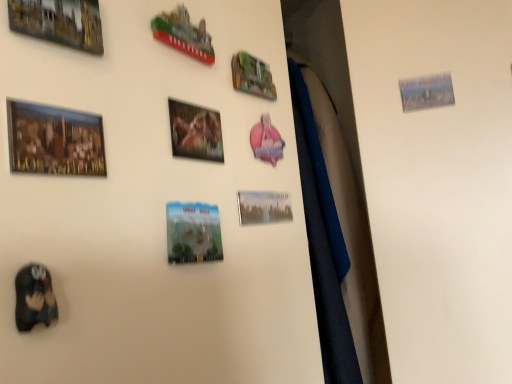
Question: Can you confirm if gold metallic picture frame at upper left, arranged as the first picture frame when viewed from the left, is bigger than matte wooden picture frame at upper left, positioned as the 2th picture frame in left-to-right order?

Choices:
 (A) yes
 (B) no

Answer: (A)

Question: Is gold metallic picture frame at upper left, arranged as the first picture frame when viewed from the left, not inside matte wooden picture frame at upper left, which appears as the seventh picture frame when viewed from the right?

Choices:
 (A) no
 (B) yes

Answer: (B)

Question: Considering the relative positions of gold metallic picture frame at upper left, arranged as the first picture frame when viewed from the left, and matte wooden picture frame at upper left, which appears as the seventh picture frame when viewed from the right, in the image provided, is gold metallic picture frame at upper left, arranged as the first picture frame when viewed from the left, in front of matte wooden picture frame at upper left, which appears as the seventh picture frame when viewed from the right,?

Choices:
 (A) yes
 (B) no

Answer: (B)

Question: Could matte wooden picture frame at upper left, positioned as the 2th picture frame in left-to-right order, be considered to be inside gold metallic picture frame at upper left, arranged as the first picture frame when viewed from the left?

Choices:
 (A) no
 (B) yes

Answer: (A)

Question: Considering the relative sizes of gold metallic picture frame at upper left, arranged as the first picture frame when viewed from the left, and matte wooden picture frame at upper left, positioned as the 2th picture frame in left-to-right order, in the image provided, is gold metallic picture frame at upper left, arranged as the first picture frame when viewed from the left, shorter than matte wooden picture frame at upper left, positioned as the 2th picture frame in left-to-right order,?

Choices:
 (A) no
 (B) yes

Answer: (A)

Question: Is matte black owl at lower left bigger or smaller than metallic silver picture frame at center, the seventh picture frame when ordered from left to right?

Choices:
 (A) small
 (B) big

Answer: (A)

Question: Would you say matte black owl at lower left is to the left or to the right of metallic silver picture frame at center, the 2th picture frame positioned from the right, in the picture?

Choices:
 (A) right
 (B) left

Answer: (B)

Question: Is matte black owl at lower left inside the boundaries of metallic silver picture frame at center, the 2th picture frame positioned from the right, or outside?

Choices:
 (A) inside
 (B) outside

Answer: (B)

Question: Is matte black owl at lower left taller or shorter than metallic silver picture frame at center, the 2th picture frame positioned from the right?

Choices:
 (A) short
 (B) tall

Answer: (B)

Question: From the image's perspective, is matte wooden picture frame at upper left, positioned as the 2th picture frame in left-to-right order, above or below metallic green sign at upper center, placed as the third picture frame when sorted from right to left?

Choices:
 (A) above
 (B) below

Answer: (B)

Question: Choose the correct answer: Is matte wooden picture frame at upper left, positioned as the 2th picture frame in left-to-right order, inside metallic green sign at upper center, marked as the 6th picture frame in a left-to-right arrangement, or outside it?

Choices:
 (A) inside
 (B) outside

Answer: (B)

Question: Would you say matte wooden picture frame at upper left, positioned as the 2th picture frame in left-to-right order, is to the left or to the right of metallic green sign at upper center, marked as the 6th picture frame in a left-to-right arrangement, in the picture?

Choices:
 (A) right
 (B) left

Answer: (B)

Question: Is point (89, 153) closer or farther from the camera than point (262, 89)?

Choices:
 (A) closer
 (B) farther

Answer: (A)

Question: Based on their positions, is gold metallic picture frame at upper left, the 8th picture frame when ordered from right to left, located to the left or right of matte plastic magnet at center, marked as the 4th picture frame in a right-to-left arrangement?

Choices:
 (A) left
 (B) right

Answer: (A)

Question: From the image's perspective, is gold metallic picture frame at upper left, the 8th picture frame when ordered from right to left, located above or below matte plastic magnet at center, the 5th picture frame from the left?

Choices:
 (A) below
 (B) above

Answer: (B)